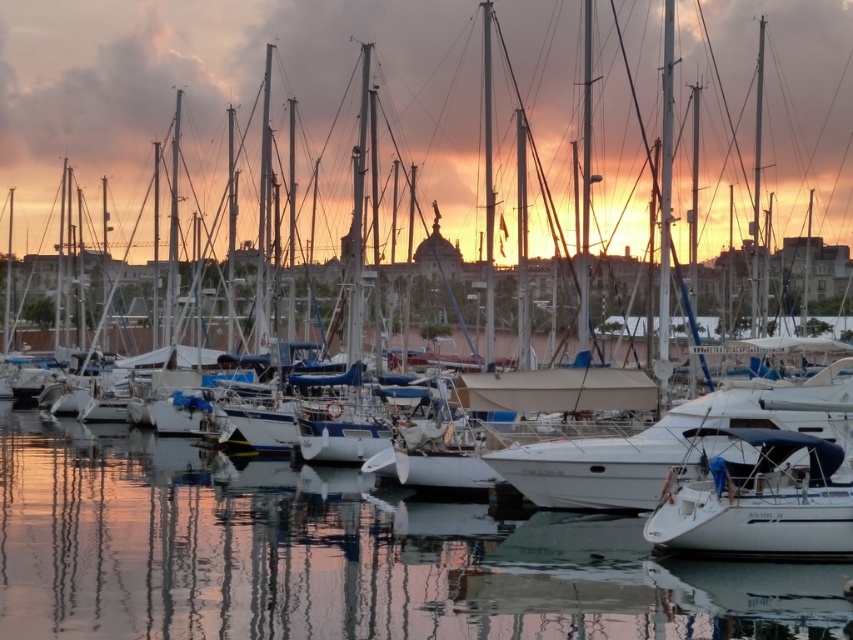
You are standing on the dock and see the clear water at center and the white matte sailboat at lower right. Which object is closer to the horizon?

The clear water at center is located below the white matte sailboat at lower right, meaning the sailboat is closer to the horizon than the water.

You are a photographer trying to capture the sunset reflection in the water. You have a camera with a wide angle lens that can capture up to 10 meters in height. The white matte sailboat at lower right is blocking your view. Can you still capture the reflection of the sunset in the clear water at center with your current setup?

The clear water at center is much taller than the white matte sailboat at lower right, so yes, the reflection of the sunset in the clear water at center can still be captured as it extends higher than the sailboat, allowing the photographer to position the camera to include the taller water area beyond the obstruction.

You are standing on the dock and see the clear water at center and the white matte sailboat at lower right. Which object is located to the right of the other?

The white matte sailboat at lower right is located to the right of the clear water at center because the clear water at center is positioned on the left side of white matte sailboat at lower right.